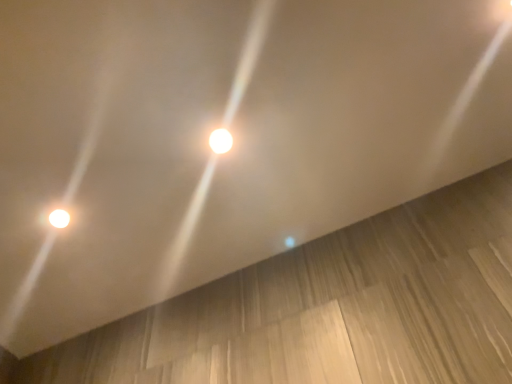
Question: Considering the positions of point (392, 276) and point (61, 215), is point (392, 276) closer or farther from the camera than point (61, 215)?

Choices:
 (A) farther
 (B) closer

Answer: (B)

Question: Considering the relative positions of light brown wood at lower right and matte white lamp at lower left, the second lamp in the top-to-bottom sequence, in the image provided, is light brown wood at lower right to the left or to the right of matte white lamp at lower left, the second lamp in the top-to-bottom sequence,?

Choices:
 (A) left
 (B) right

Answer: (B)

Question: Estimate the real-world distances between objects in this image. Which object is closer to the matte white lamp at lower left, arranged as the second lamp when viewed from the right?

Choices:
 (A) light brown wood at lower right
 (B) white glossy light at center, which is the 2th lamp in left-to-right order

Answer: (B)

Question: Estimate the real-world distances between objects in this image. Which object is closer to the light brown wood at lower right?

Choices:
 (A) matte white lamp at lower left, the first lamp when ordered from back to front
 (B) white glossy light at center, arranged as the first lamp when viewed from the right

Answer: (B)